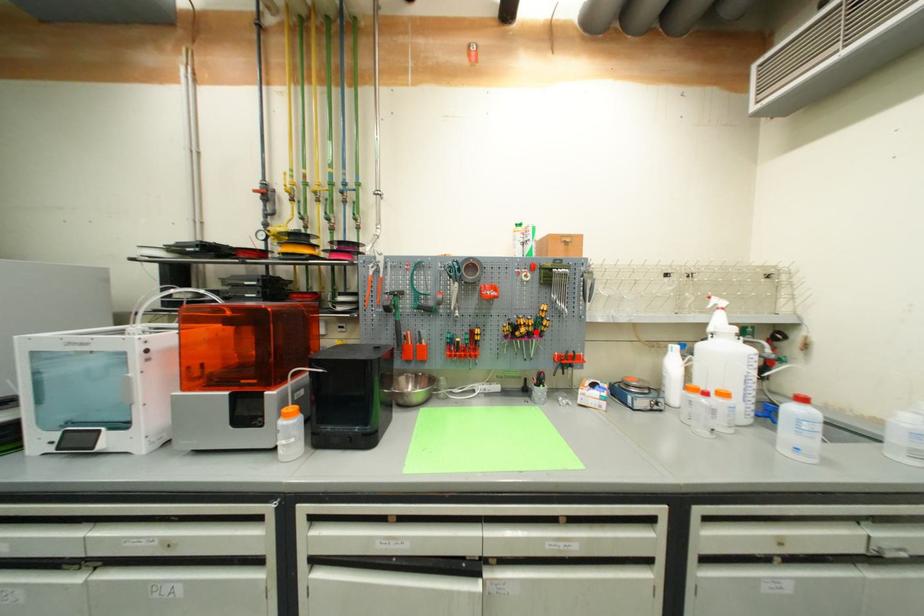
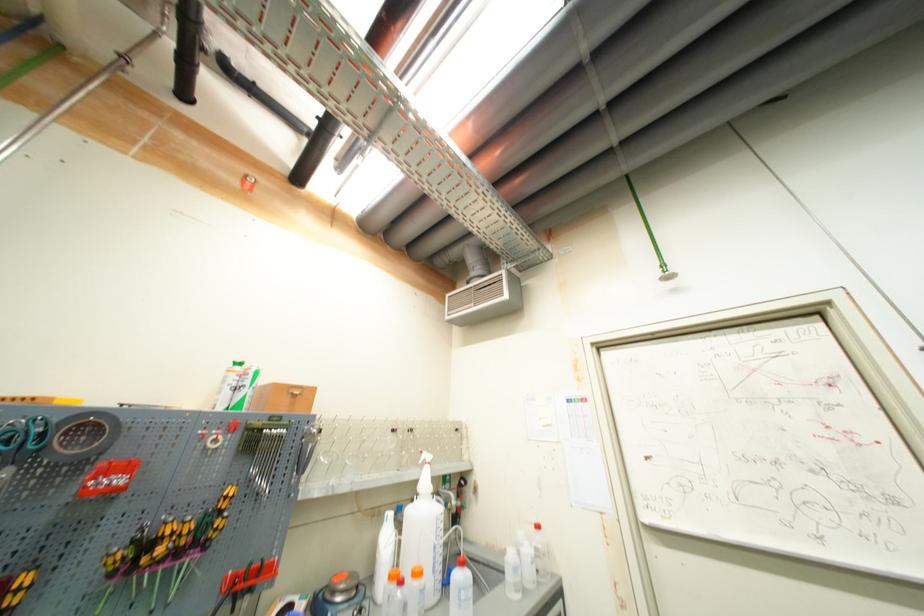
In the second image, find the point that corresponds to the highlighted location in the first image.

(188, 545)